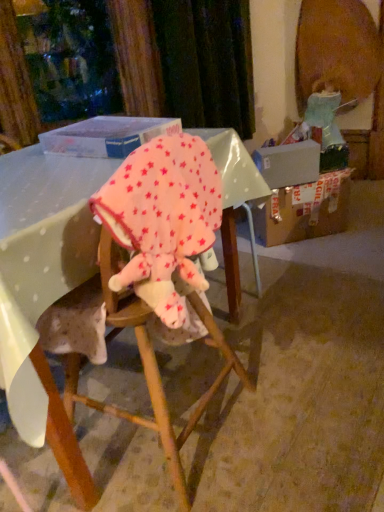
Question: From a real-world perspective, is brown cardboard box at right physically located above or below pink fleece baby elephant at center?

Choices:
 (A) above
 (B) below

Answer: (B)

Question: Relative to pink fleece baby elephant at center, is brown cardboard box at right in front or behind?

Choices:
 (A) front
 (B) behind

Answer: (B)

Question: Which of these objects is positioned closest to the brown cardboard box at right?

Choices:
 (A) translucent plastic box at upper center
 (B) pink fleece baby elephant at center
 (C) pink fleece blanket at center

Answer: (A)

Question: Which object is positioned closest to the translucent plastic box at upper center?

Choices:
 (A) pink fleece blanket at center
 (B) brown cardboard box at right
 (C) pink fleece baby elephant at center

Answer: (C)